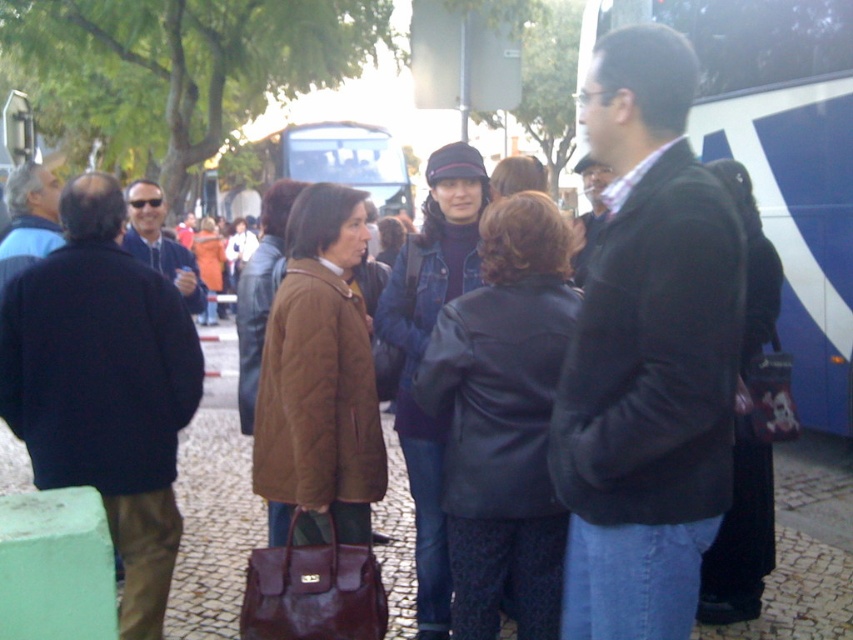
Is blue painted bus at right wider than blue metallic bus at center?

In fact, blue painted bus at right might be narrower than blue metallic bus at center.

Can you confirm if blue painted bus at right is smaller than blue metallic bus at center?

Correct, blue painted bus at right occupies less space than blue metallic bus at center.

Describe the element at coordinates (779, 156) in the screenshot. The height and width of the screenshot is (640, 853). I see `blue painted bus at right` at that location.

You are a GUI agent. You are given a task and a screenshot of the screen. Output one action in this format:
    pyautogui.click(x=<x>, y=<y>)
    Task: Click on the blue painted bus at right
    
    Given the screenshot: What is the action you would take?
    pyautogui.click(x=779, y=156)

Is point (103, 356) farther from viewer compared to point (717, 22)?

No, it is in front of (717, 22).

Between point (73, 372) and point (808, 400), which one is positioned in front?

Point (73, 372)

The width and height of the screenshot is (853, 640). I want to click on dark brown leather bag at lower left, so click(x=103, y=387).

Find the location of a particular element. The width and height of the screenshot is (853, 640). dark brown leather bag at lower left is located at coordinates (103, 387).

Who is shorter, dark brown leather bag at lower left or blue metallic bus at center?

dark brown leather bag at lower left is shorter.

Is point (167, 516) farther from camera compared to point (407, 211)?

No, (167, 516) is in front of (407, 211).

This screenshot has height=640, width=853. What do you see at coordinates (103, 387) in the screenshot?
I see `dark brown leather bag at lower left` at bounding box center [103, 387].

Find the location of a particular element. The width and height of the screenshot is (853, 640). dark brown leather bag at lower left is located at coordinates (103, 387).